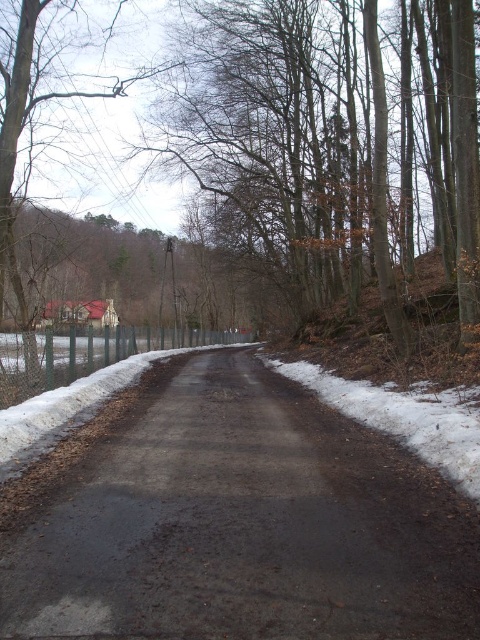
You are a delivery driver trying to navigate a narrow road through a forest. You see the dark asphalt road at center and the white powdery snow at right. Can you safely drive your truck, which is 8 feet wide, between them?

The distance between the dark asphalt road at center and the white powdery snow at right is 7.98 feet, which is slightly less than the truck width of 8 feet. Therefore, it is not safe to drive the truck between them.